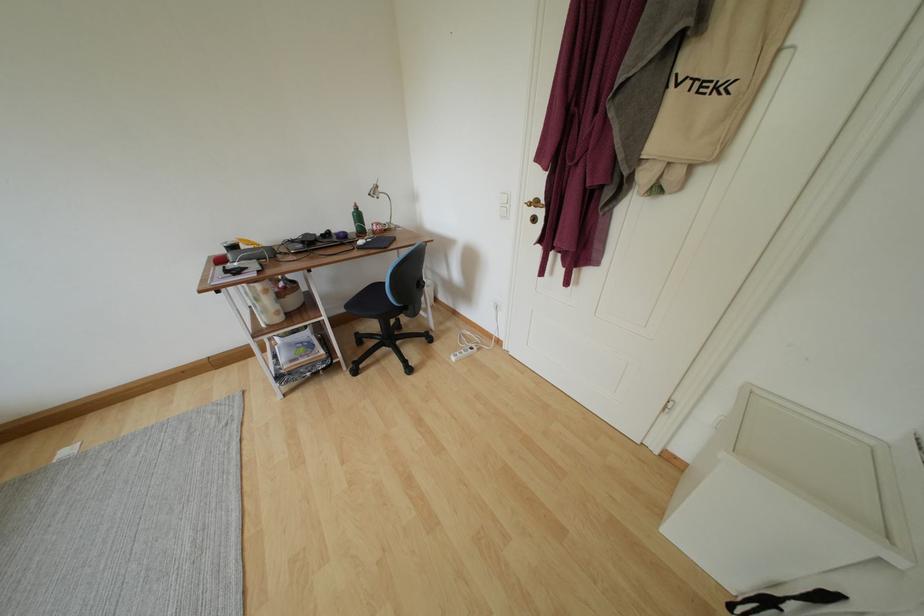
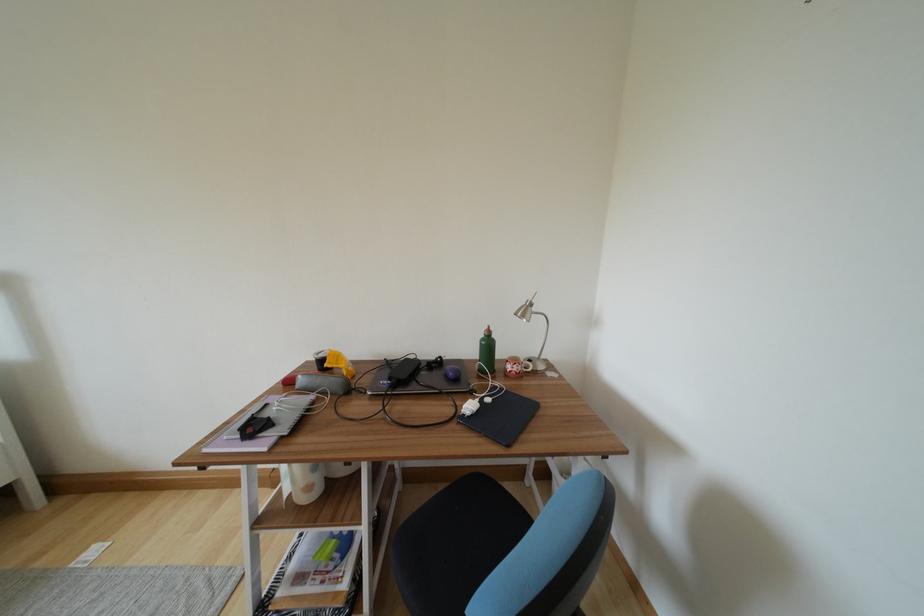
Locate, in the second image, the point that corresponds to point (236, 262) in the first image.

(306, 385)